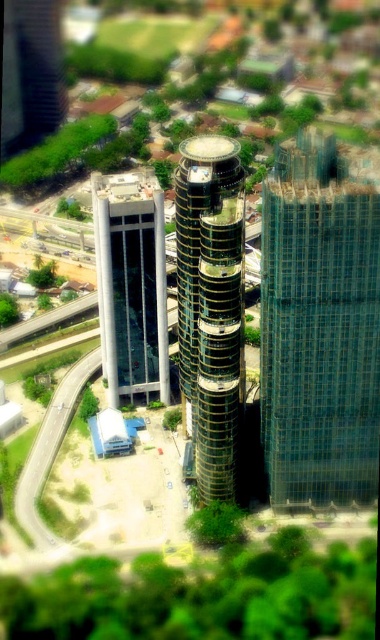
Question: Does transparent glass tower at right have a greater width compared to glassy black tower at center?

Choices:
 (A) no
 (B) yes

Answer: (B)

Question: Does glassy black tower at center have a larger size compared to white concrete building at left?

Choices:
 (A) no
 (B) yes

Answer: (A)

Question: Considering the relative positions of glassy black tower at center and white concrete building at left in the image provided, where is glassy black tower at center located with respect to white concrete building at left?

Choices:
 (A) right
 (B) left

Answer: (A)

Question: Which of the following is the closest to the observer?

Choices:
 (A) transparent glass tower at right
 (B) glassy black tower at center

Answer: (A)

Question: Which object is the farthest from the glassy black tower at center?

Choices:
 (A) transparent glass tower at right
 (B) white concrete building at left

Answer: (B)

Question: Which object is closer to the camera taking this photo?

Choices:
 (A) white concrete building at left
 (B) glassy black tower at center

Answer: (B)